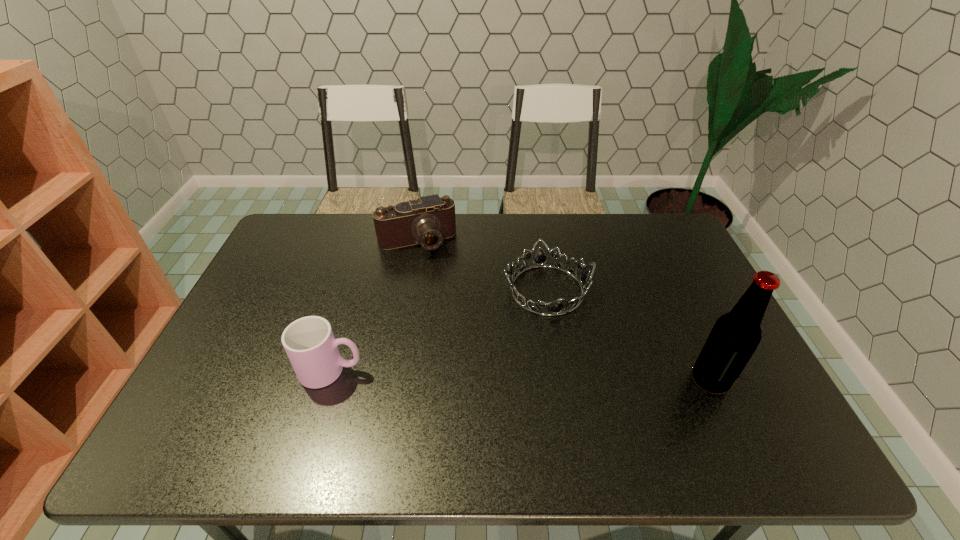
In order to click on vacant space situated 0.270m on the front-facing side of the second object from right to left in this screenshot , I will do `click(586, 408)`.

Locate an element on the screen. Image resolution: width=960 pixels, height=540 pixels. vacant space situated on the front-facing side of the farthest object is located at coordinates (435, 279).

This screenshot has width=960, height=540. Find the location of `vacant space situated 0.330m on the front-facing side of the farthest object`. vacant space situated 0.330m on the front-facing side of the farthest object is located at coordinates (455, 329).

Image resolution: width=960 pixels, height=540 pixels. Identify the location of vacant region located on the front-facing side of the farthest object. (448, 312).

Find the location of a particular element. The width and height of the screenshot is (960, 540). object positioned at the far edge is located at coordinates (428, 220).

Find the location of a particular element. The image size is (960, 540). cup at the near edge is located at coordinates (309, 342).

Where is `beer bottle at the near edge`? Image resolution: width=960 pixels, height=540 pixels. beer bottle at the near edge is located at coordinates (735, 336).

Find the location of a particular element. The height and width of the screenshot is (540, 960). object that is at the right edge is located at coordinates (735, 336).

Find the location of `object that is at the near right corner`. object that is at the near right corner is located at coordinates (735, 336).

Where is `free region at the far edge of the desktop`? This screenshot has width=960, height=540. free region at the far edge of the desktop is located at coordinates (484, 252).